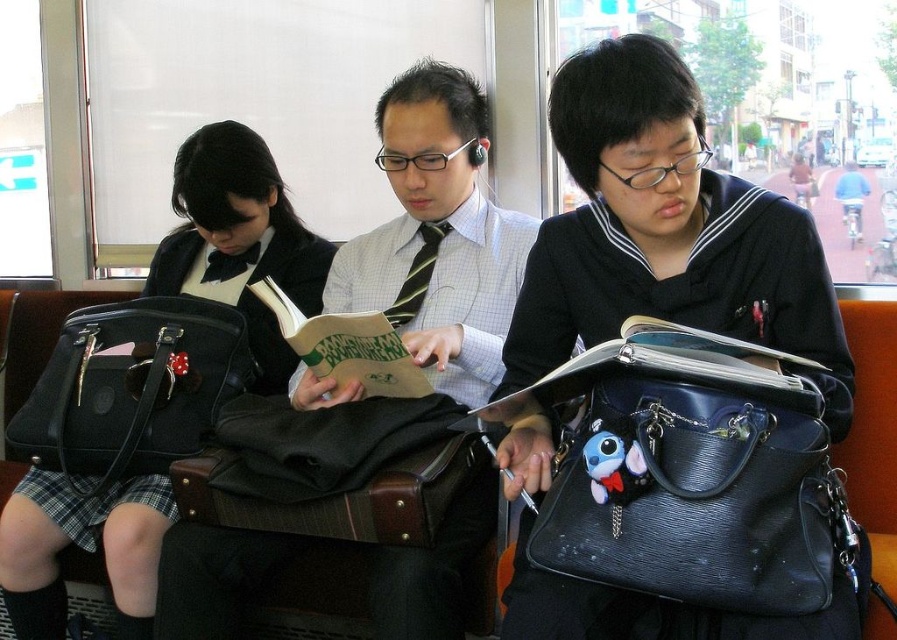
Between black leather bag at left and hardcover book at center, which one is positioned lower?

Positioned lower is black leather bag at left.

Which is behind, point (147, 412) or point (654, 321)?

Point (147, 412)

Which is in front, point (164, 396) or point (625, 339)?

Positioned in front is point (625, 339).

Locate an element on the screen. black leather bag at left is located at coordinates (131, 387).

Is matte black book at center further to camera compared to black leather bag at left?

No, it is in front of black leather bag at left.

Does matte black book at center have a lesser height compared to black leather bag at left?

Incorrect, matte black book at center's height does not fall short of black leather bag at left's.

Identify the location of matte black book at center. (438, 236).

Who is taller, matte black tie at center or hardcover book at center?

matte black tie at center

This screenshot has width=897, height=640. Describe the element at coordinates (666, 230) in the screenshot. I see `matte black tie at center` at that location.

Locate an element on the screen. The height and width of the screenshot is (640, 897). matte black tie at center is located at coordinates tap(666, 230).